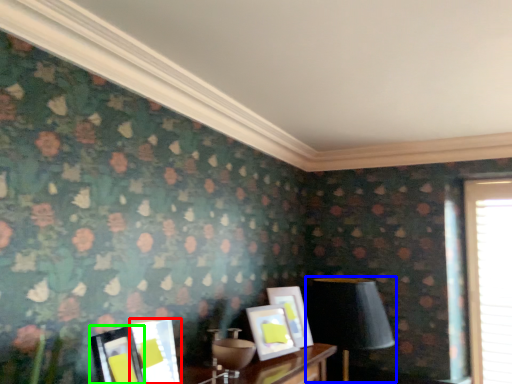
Question: Estimate the real-world distances between objects in this image. Which object is farther from picture frame (highlighted by a red box), table lamp (highlighted by a blue box) or picture frame (highlighted by a green box)?

Choices:
 (A) table lamp
 (B) picture frame

Answer: (A)